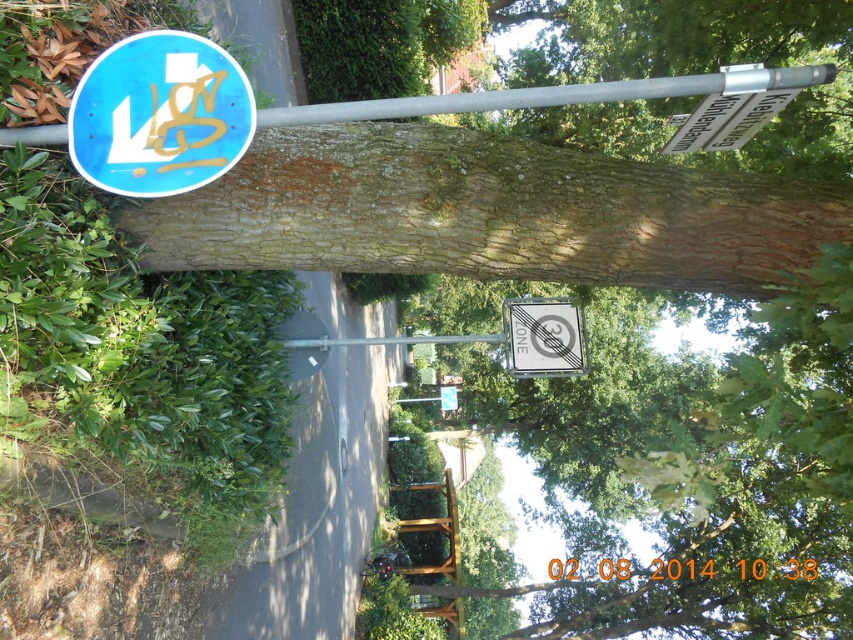
Is silver metallic pole at upper center further to the viewer compared to metallic gray no parking sign at center?

No, silver metallic pole at upper center is closer to the viewer.

Is the position of silver metallic pole at upper center less distant than that of metallic gray no parking sign at center?

Yes, it is in front of metallic gray no parking sign at center.

Measure the distance between silver metallic pole at upper center and camera.

silver metallic pole at upper center and camera are 1.58 meters apart from each other.

Locate an element on the screen. Image resolution: width=853 pixels, height=640 pixels. silver metallic pole at upper center is located at coordinates (540, 97).

This screenshot has height=640, width=853. Describe the element at coordinates (160, 115) in the screenshot. I see `blue glossy traffic sign at upper left` at that location.

Between point (142, 61) and point (537, 342), which one is positioned in front?

Point (142, 61) is in front.

Which is behind, point (131, 60) or point (548, 323)?

Point (548, 323)

The width and height of the screenshot is (853, 640). Find the location of `blue glossy traffic sign at upper left`. blue glossy traffic sign at upper left is located at coordinates point(160,115).

Is blue glossy traffic sign at upper left above silver metallic pole at upper center?

No.

Which is more to the left, blue glossy traffic sign at upper left or silver metallic pole at upper center?

blue glossy traffic sign at upper left is more to the left.

Find the location of `blue glossy traffic sign at upper left`. blue glossy traffic sign at upper left is located at coordinates (160, 115).